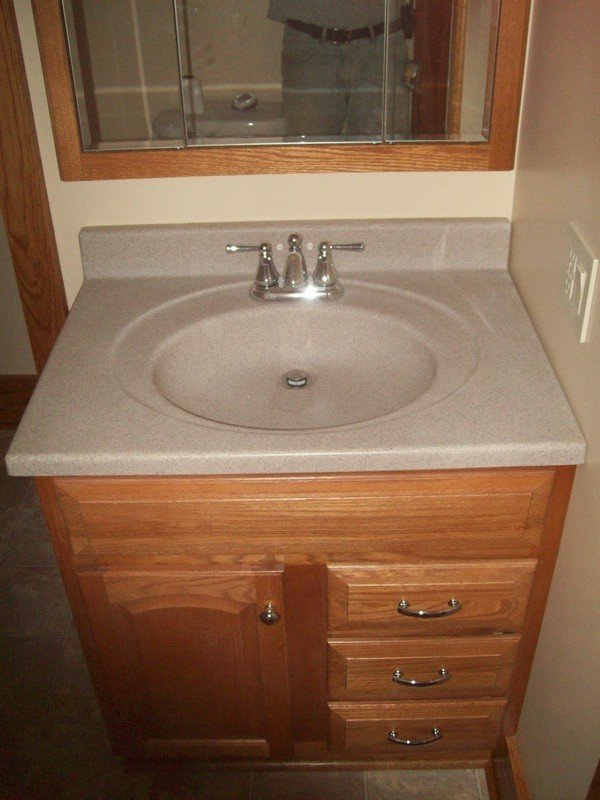
Identify the location of mirror's frame. The height and width of the screenshot is (800, 600). (274, 158).